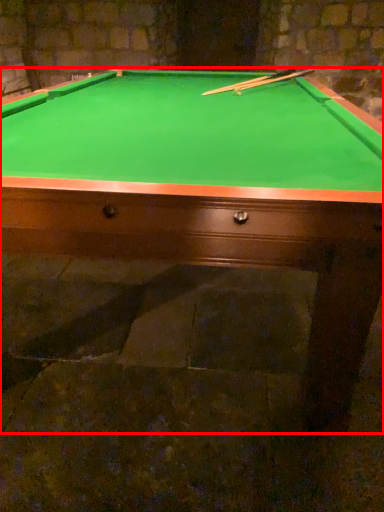
Question: From the image's perspective, where is billiard table (annotated by the red box) located in relation to cue in the image?

Choices:
 (A) above
 (B) below

Answer: (B)